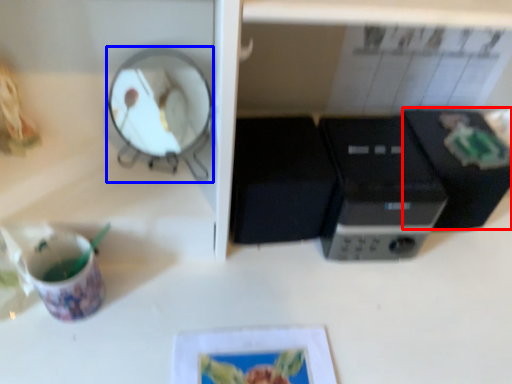
Question: Which point is closer to the camera, appliance (highlighted by a red box) or mirror (highlighted by a blue box)?

Choices:
 (A) appliance
 (B) mirror

Answer: (B)